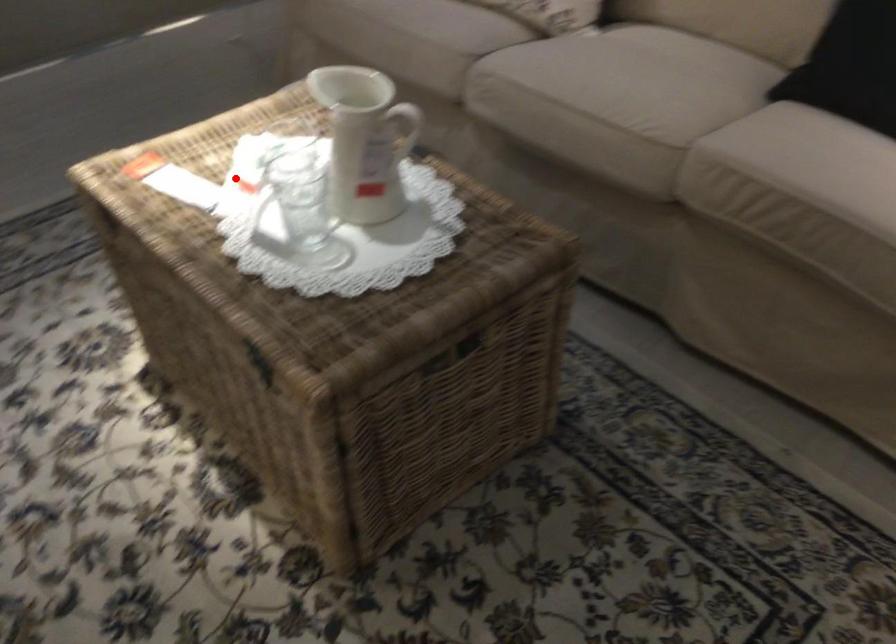
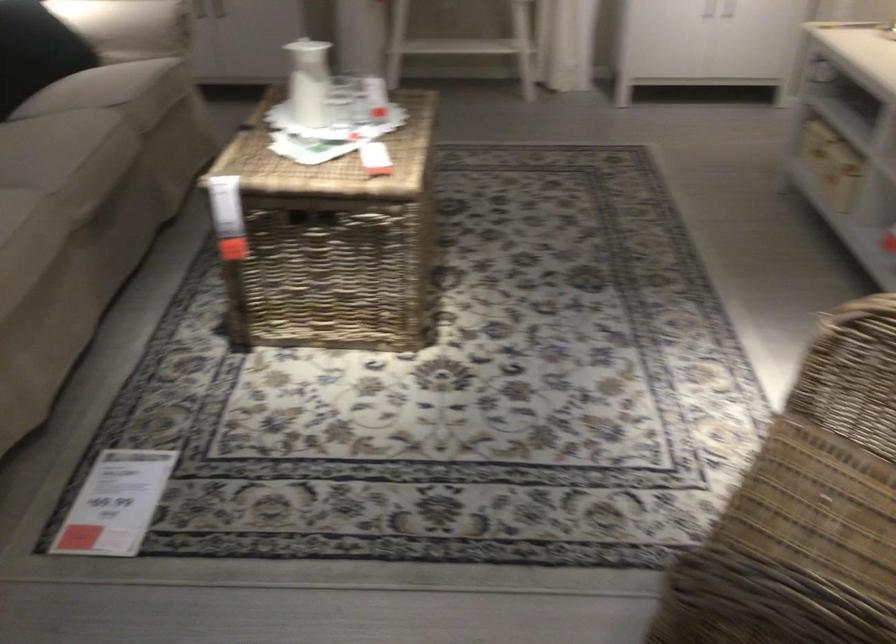
Question: I am providing you with two images of the same scene from different viewpoints. In image1, a red point is highlighted. Considering the same 3D point in image2, which of the following is correct?

Choices:
 (A) It is closer
 (B) It is farther

Answer: (B)